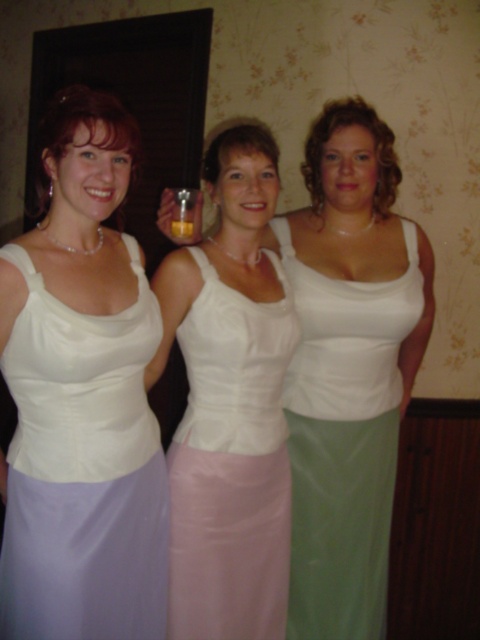
Question: Is matte white dress at left closer to the viewer compared to white satin dress at center?

Choices:
 (A) yes
 (B) no

Answer: (A)

Question: Does matte white dress at left appear over satin white dress at center?

Choices:
 (A) no
 (B) yes

Answer: (B)

Question: Estimate the real-world distances between objects in this image. Which object is farther from the satin white dress at center?

Choices:
 (A) matte white dress at left
 (B) matte white tank top at center
 (C) white satin dress at center

Answer: (B)

Question: Is matte white tank top at center smaller than white satin dress at center?

Choices:
 (A) yes
 (B) no

Answer: (B)

Question: Which point appears farthest from the camera in this image?

Choices:
 (A) (392, 305)
 (B) (135, 348)
 (C) (324, 580)

Answer: (C)

Question: Considering the real-world distances, which object is closest to the satin white dress at center?

Choices:
 (A) matte white dress at left
 (B) white satin dress at center
 (C) matte white tank top at center

Answer: (A)